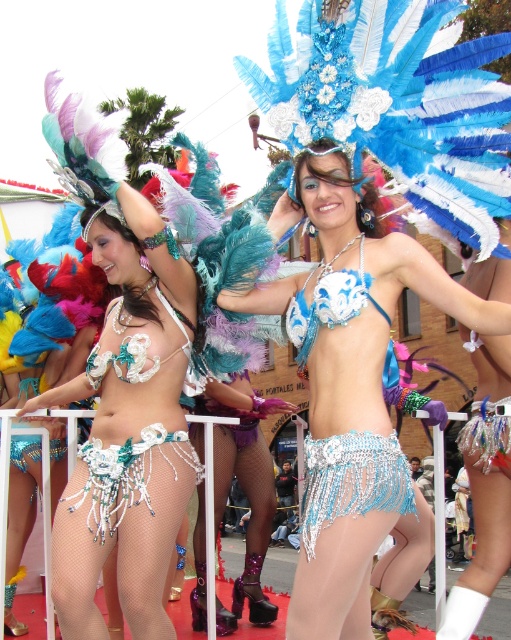
You are a photographer positioned at the front of the parade. You want to capture a photo that includes both the matte silver bikini at center and the pearl beaded skirt at center. Given that your camera has a maximum focus range of 25 inches, will you be able to capture both objects in focus without moving your position?

The matte silver bikini at center is 28.32 inches away from the pearl beaded skirt at center. Since the distance between them exceeds the camera maximum focus range of 25 inches, you will not be able to capture both objects in focus without moving your position.

You are a photographer at the parade and want to capture both the matte silver bikini at center and the pearl beaded skirt at center in a single frame. Considering their sizes, which object should you focus on to ensure both are visible without cropping?

The matte silver bikini at center is much taller than the pearl beaded skirt at center, so focusing on the taller matte silver bikini at center would help ensure both are visible in the frame.